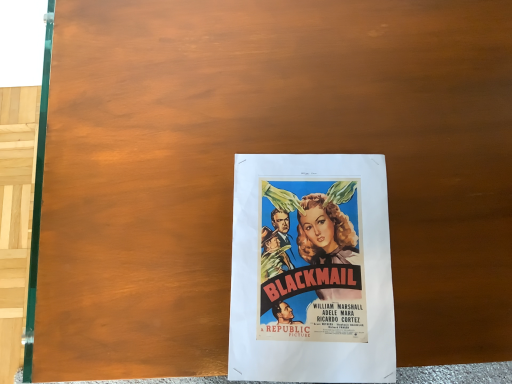
What are the coordinates of `free location to the right of white paper poster at center` in the screenshot? It's located at (452, 230).